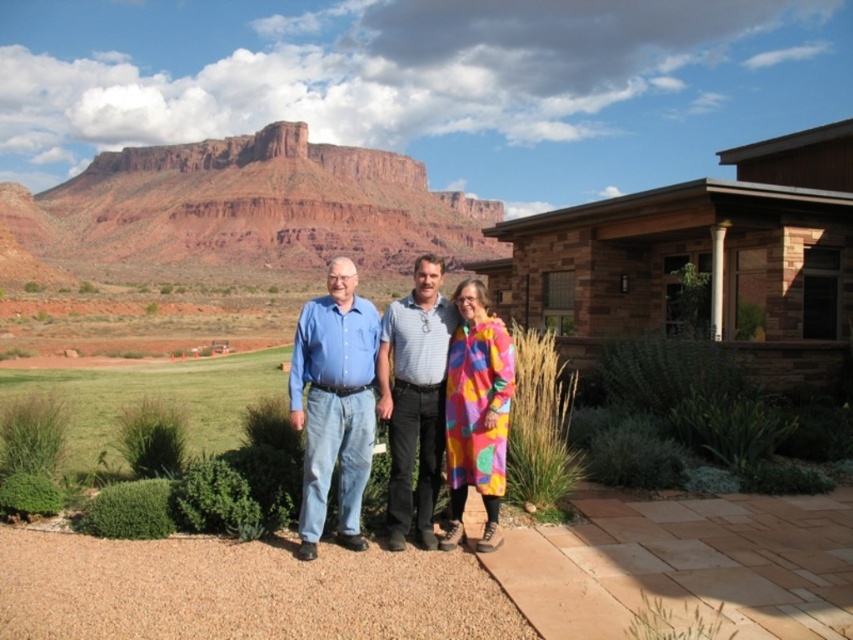
Question: Does blue denim jeans at center appear on the right side of gray textured shirt at center?

Choices:
 (A) yes
 (B) no

Answer: (B)

Question: Among these points, which one is farthest from the camera?

Choices:
 (A) pos(381,340)
 (B) pos(346,204)
 (C) pos(502,465)

Answer: (B)

Question: Which point is closer to the camera taking this photo?

Choices:
 (A) (345, 371)
 (B) (397, 365)
 (C) (398, 419)
 (D) (474, 218)

Answer: (A)

Question: Is multicolored fabric at center below gray textured shirt at center?

Choices:
 (A) yes
 (B) no

Answer: (A)

Question: Which of the following is the closest to the observer?

Choices:
 (A) (256, 166)
 (B) (340, 509)
 (C) (318, 504)
 (D) (474, 451)

Answer: (C)

Question: Does blue denim jeans at center have a lesser width compared to gray textured shirt at center?

Choices:
 (A) no
 (B) yes

Answer: (A)